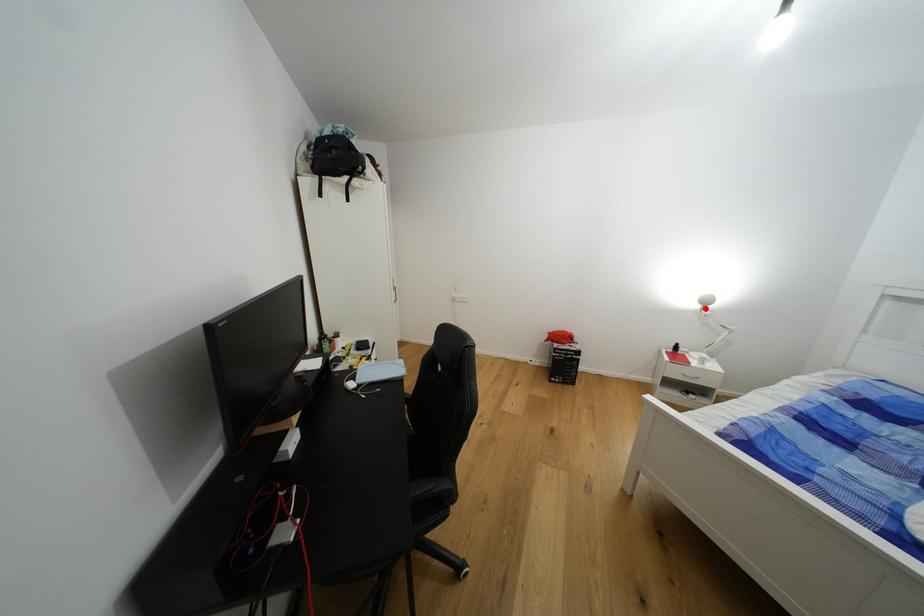
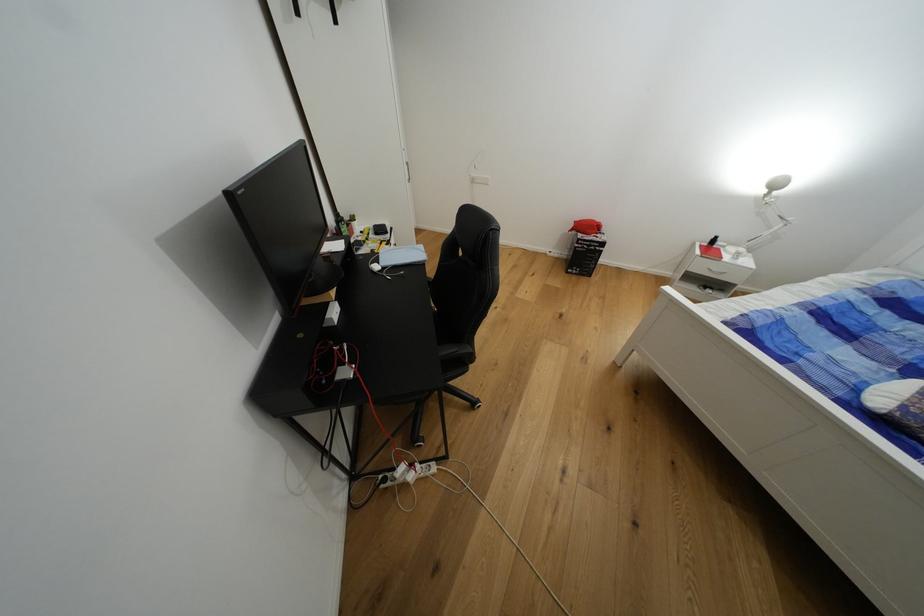
In the second image, find the point that corresponds to the highlighted location in the first image.

(771, 193)